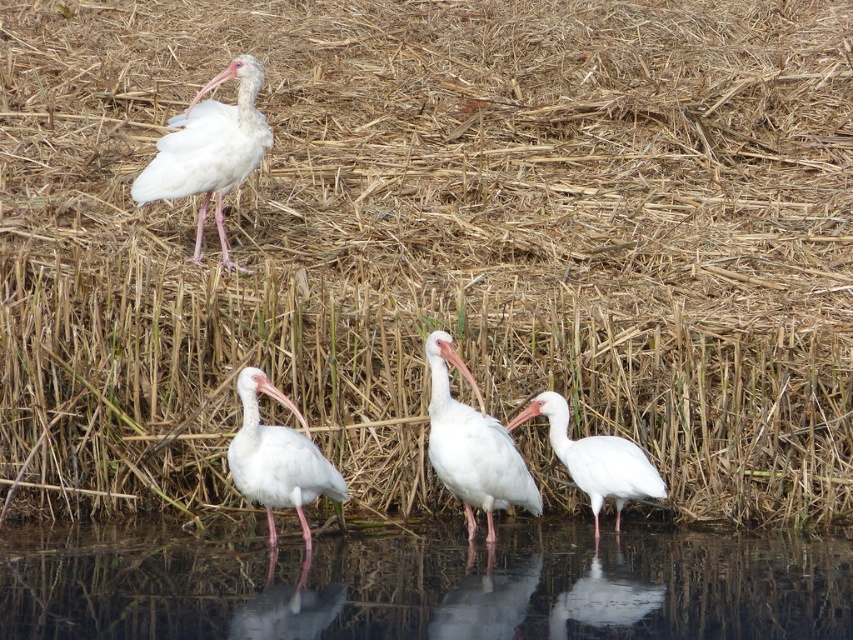
How far apart are transparent water at lower center and white matte bird at lower center?

transparent water at lower center is 33.05 inches away from white matte bird at lower center.

Between transparent water at lower center and white matte bird at lower center, which one appears on the right side from the viewer's perspective?

From the viewer's perspective, white matte bird at lower center appears more on the right side.

Is point (726, 541) closer to camera compared to point (601, 449)?

No, it is not.

I want to click on transparent water at lower center, so click(x=422, y=586).

Which of these two, transparent water at lower center or white matte bird at center, stands taller?

white matte bird at center

Does transparent water at lower center come in front of white matte bird at center?

Yes, transparent water at lower center is in front of white matte bird at center.

Measure the distance between transparent water at lower center and camera.

transparent water at lower center and camera are 5.36 meters apart.

Where is `transparent water at lower center`? The width and height of the screenshot is (853, 640). transparent water at lower center is located at coordinates (422, 586).

Which is in front, point (596, 556) or point (279, 460)?

Point (279, 460)

Is transparent water at lower center further to the viewer compared to white matte ibis at lower center?

No, transparent water at lower center is in front of white matte ibis at lower center.

Between point (212, 616) and point (254, 440), which one is positioned behind?

The point (254, 440) is behind.

In order to click on transparent water at lower center in this screenshot , I will do `click(422, 586)`.